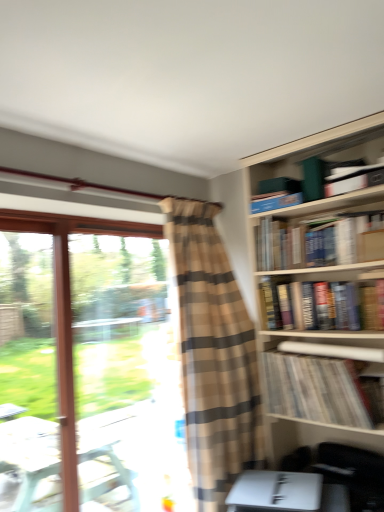
Question: Is blue hardcover book at upper right, which is the second book in top-to-bottom order, surrounded by hardcover book at upper right, which is the 3th book from top to bottom?

Choices:
 (A) yes
 (B) no

Answer: (B)

Question: From a real-world perspective, is hardcover book at upper right, marked as the fourth book in a bottom-to-top arrangement, on top of blue hardcover book at upper right, which is the second book in top-to-bottom order?

Choices:
 (A) yes
 (B) no

Answer: (B)

Question: Does hardcover book at upper right, marked as the fourth book in a bottom-to-top arrangement, have a greater width compared to blue hardcover book at upper right, which is counted as the fifth book, starting from the bottom?

Choices:
 (A) yes
 (B) no

Answer: (A)

Question: Can you confirm if hardcover book at upper right, which is the 3th book from top to bottom, is thinner than blue hardcover book at upper right, which is counted as the fifth book, starting from the bottom?

Choices:
 (A) no
 (B) yes

Answer: (A)

Question: Is the depth of hardcover book at upper right, which is the 3th book from top to bottom, greater than that of blue hardcover book at upper right, which is counted as the fifth book, starting from the bottom?

Choices:
 (A) no
 (B) yes

Answer: (A)

Question: From the image's perspective, is hardcover book at upper right, which is the 3th book from top to bottom, below blue hardcover book at upper right, which is counted as the fifth book, starting from the bottom?

Choices:
 (A) yes
 (B) no

Answer: (A)

Question: Does clear glass window at left appear on the left side of striped paper at upper right, which ranks as the 6th book in top-to-bottom order?

Choices:
 (A) no
 (B) yes

Answer: (B)

Question: Considering the relative sizes of clear glass window at left and striped paper at upper right, which ranks as the 6th book in top-to-bottom order, in the image provided, is clear glass window at left smaller than striped paper at upper right, which ranks as the 6th book in top-to-bottom order,?

Choices:
 (A) no
 (B) yes

Answer: (A)

Question: Is clear glass window at left at the right side of striped paper at upper right, the 1th book in the bottom-to-top sequence?

Choices:
 (A) no
 (B) yes

Answer: (A)

Question: Is clear glass window at left next to striped paper at upper right, which ranks as the 6th book in top-to-bottom order, and touching it?

Choices:
 (A) no
 (B) yes

Answer: (A)

Question: Are clear glass window at left and striped paper at upper right, which ranks as the 6th book in top-to-bottom order, far apart?

Choices:
 (A) yes
 (B) no

Answer: (B)

Question: Considering the relative sizes of clear glass window at left and striped paper at upper right, which ranks as the 6th book in top-to-bottom order, in the image provided, is clear glass window at left thinner than striped paper at upper right, which ranks as the 6th book in top-to-bottom order,?

Choices:
 (A) yes
 (B) no

Answer: (A)

Question: From a real-world perspective, is white paper at center-right, placed as the 2th book when sorted from bottom to top, over brown plaid curtain at center?

Choices:
 (A) yes
 (B) no

Answer: (A)